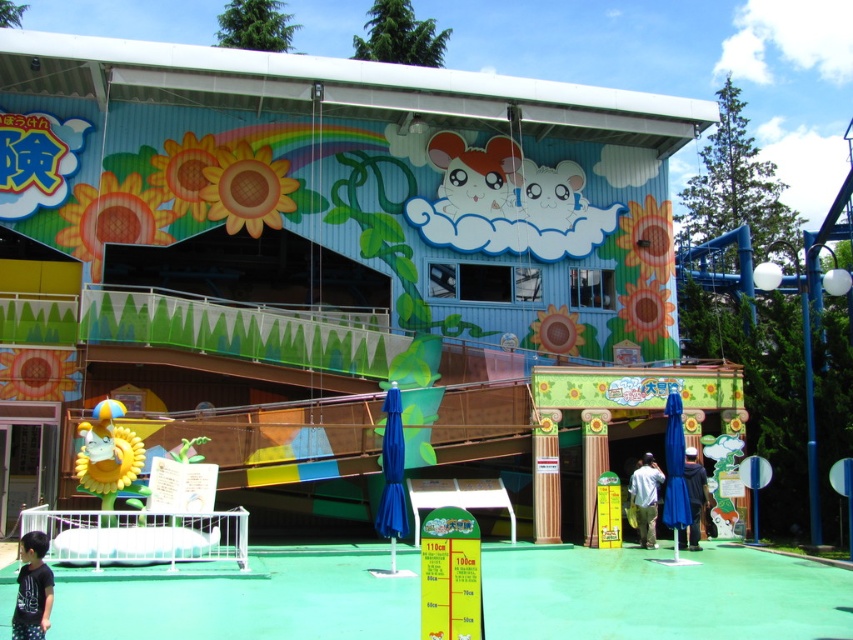
Between black cotton shirt at lower left and dark blue fabric jacket at lower center, which one has more height?

Standing taller between the two is dark blue fabric jacket at lower center.

What do you see at coordinates (32, 588) in the screenshot? I see `black cotton shirt at lower left` at bounding box center [32, 588].

Who is more forward, (45, 609) or (705, 493)?

Point (45, 609) is more forward.

The width and height of the screenshot is (853, 640). In order to click on black cotton shirt at lower left in this screenshot , I will do `click(32, 588)`.

Does black cotton shirt at lower left have a smaller size compared to white fabric shirt at lower right?

Actually, black cotton shirt at lower left might be larger than white fabric shirt at lower right.

The height and width of the screenshot is (640, 853). Identify the location of black cotton shirt at lower left. (32, 588).

You are a GUI agent. You are given a task and a screenshot of the screen. Output one action in this format:
    pyautogui.click(x=<x>, y=<y>)
    Task: Click on the black cotton shirt at lower left
    The image size is (853, 640).
    Given the screenshot: What is the action you would take?
    pyautogui.click(x=32, y=588)

Is point (640, 538) positioned after point (691, 480)?

Yes, it is.

Does white fabric shirt at lower right have a smaller size compared to dark blue fabric jacket at lower center?

No, white fabric shirt at lower right is not smaller than dark blue fabric jacket at lower center.

This screenshot has width=853, height=640. In order to click on white fabric shirt at lower right in this screenshot , I will do `click(643, 499)`.